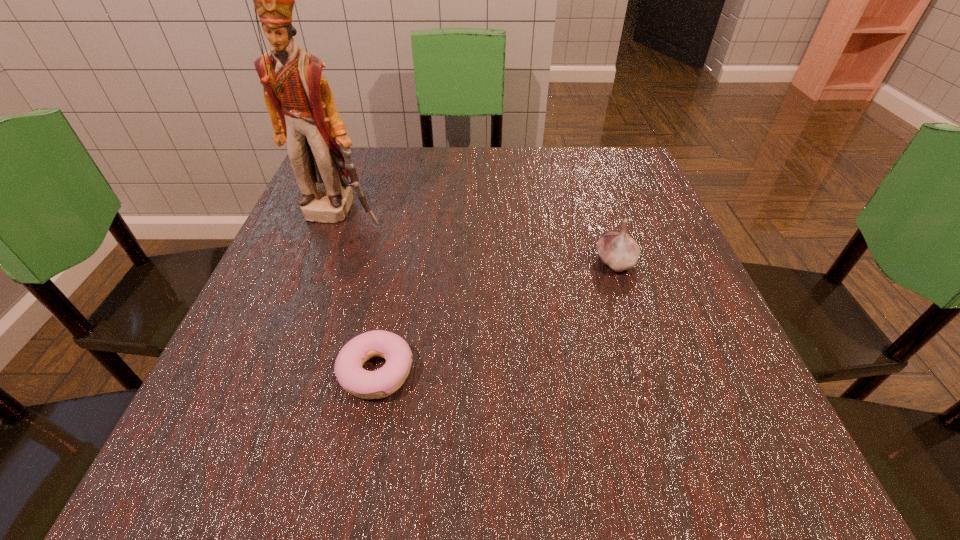
Locate an element on the screen. This screenshot has width=960, height=540. the closest object relative to the nutcracker is located at coordinates (381, 383).

Identify the location of vacant space that satisfies the following two spatial constraints: 1. on the front-facing side of the doughnut; 2. on the left side of the tallest object. (279, 372).

Find the location of a particular element. The height and width of the screenshot is (540, 960). free space in the image that satisfies the following two spatial constraints: 1. on the front-facing side of the nearest object; 2. on the left side of the tallest object is located at coordinates (279, 372).

What are the coordinates of `free location that satisfies the following two spatial constraints: 1. on the front-facing side of the rightmost object; 2. on the right side of the nutcracker` in the screenshot? It's located at (322, 262).

Locate an element on the screen. The image size is (960, 540). free space that satisfies the following two spatial constraints: 1. on the back side of the nearest object; 2. on the right side of the rightmost object is located at coordinates (398, 262).

You are a GUI agent. You are given a task and a screenshot of the screen. Output one action in this format:
    pyautogui.click(x=<x>, y=<y>)
    Task: Click on the free space that satisfies the following two spatial constraints: 1. on the front-facing side of the shortest object; 2. on the left side of the farthest object
    
    Given the screenshot: What is the action you would take?
    pyautogui.click(x=279, y=372)

Locate an element on the screen. free region that satisfies the following two spatial constraints: 1. on the front-facing side of the farthest object; 2. on the left side of the garlic is located at coordinates (322, 262).